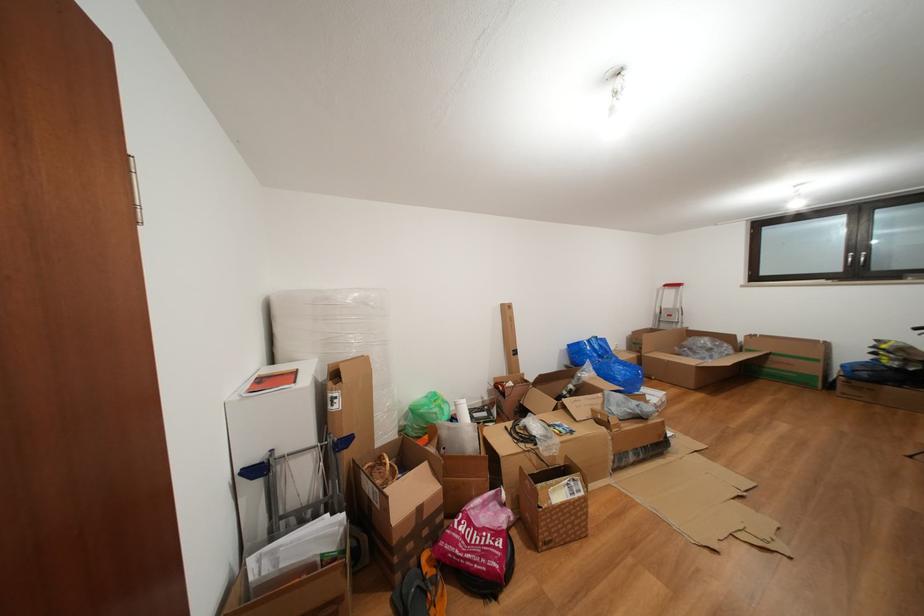
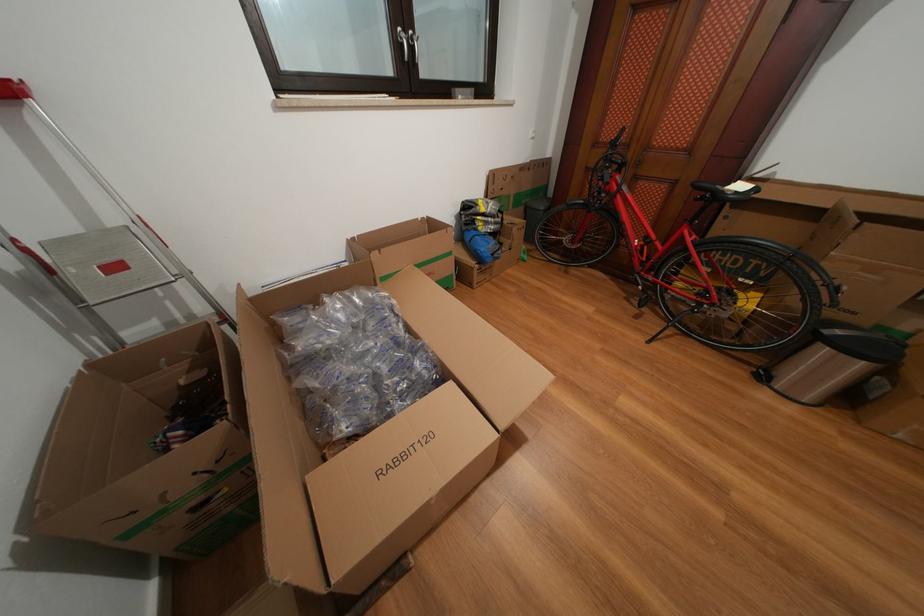
Question: I am providing you with two images of the same scene from different viewpoints. After the viewpoint changes to image2, which objects are now occluded?

Choices:
 (A) trash can pedal
 (B) red bicycle handlebar
 (C) window handle
 (D) none of these

Answer: (D)